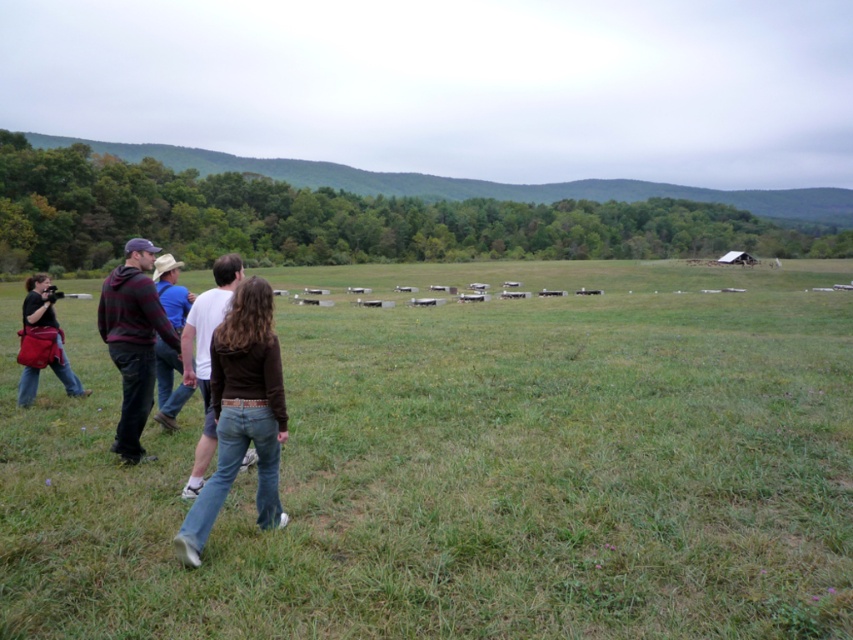
Question: Is denim jeans at center to the left of matte black camera at left from the viewer's perspective?

Choices:
 (A) yes
 (B) no

Answer: (B)

Question: Does green grass pasture at center appear on the right side of denim jeans at center?

Choices:
 (A) yes
 (B) no

Answer: (B)

Question: Does green grass pasture at center appear on the left side of denim jeans at center?

Choices:
 (A) no
 (B) yes

Answer: (B)

Question: Which object is closer to the camera taking this photo?

Choices:
 (A) plaid wool sweater at left
 (B) denim jeans at center
 (C) denim jeans at left
 (D) matte black camera at left

Answer: (B)

Question: Which is farther from the matte black camera at left?

Choices:
 (A) denim jeans at left
 (B) denim jeans at center

Answer: (B)

Question: Estimate the real-world distances between objects in this image. Which object is closer to the matte black camera at left?

Choices:
 (A) denim jeans at left
 (B) plaid wool sweater at left

Answer: (B)